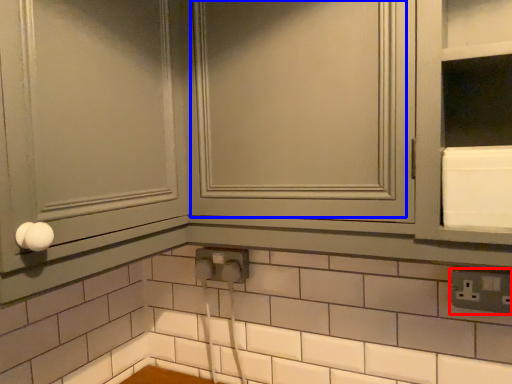
Question: Which object is further to the camera taking this photo, electric outlet (highlighted by a red box) or window (highlighted by a blue box)?

Choices:
 (A) electric outlet
 (B) window

Answer: (A)